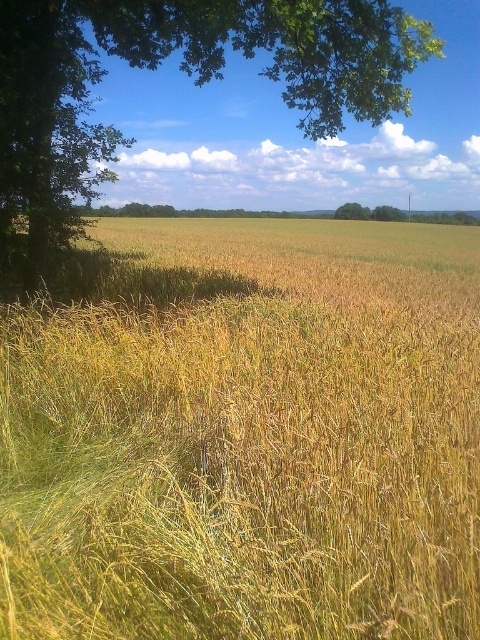
Question: Which point is farther to the camera?

Choices:
 (A) green leafy tree at upper left
 (B) yellow grass at center

Answer: (A)

Question: In this image, where is yellow grass at center located relative to green leafy tree at upper left?

Choices:
 (A) right
 (B) left

Answer: (A)

Question: Is yellow grass at center smaller than green leafy tree at upper left?

Choices:
 (A) yes
 (B) no

Answer: (A)

Question: Can you confirm if yellow grass at center is wider than green leafy tree at upper left?

Choices:
 (A) yes
 (B) no

Answer: (B)

Question: Which object appears farthest from the camera in this image?

Choices:
 (A) yellow grass at center
 (B) green leafy tree at upper left

Answer: (B)